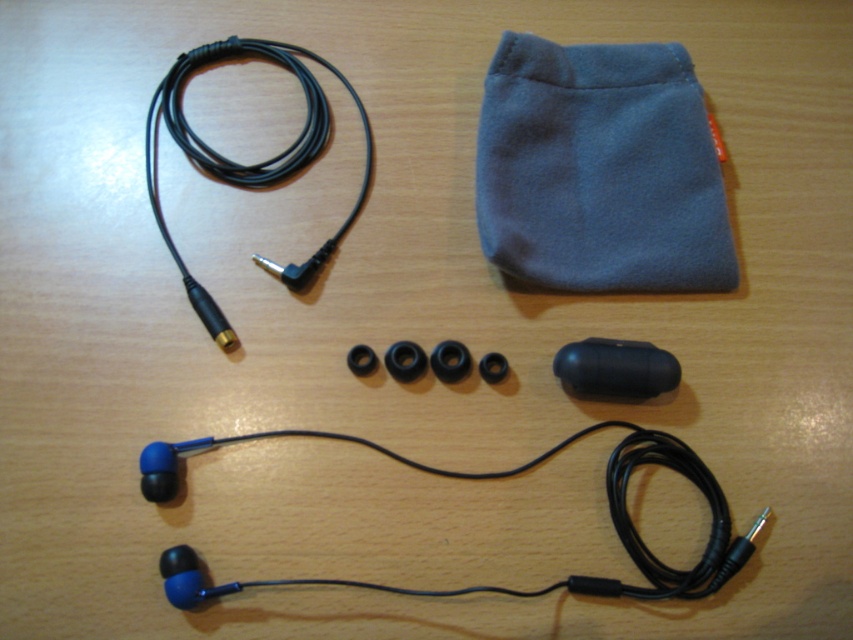
Question: Among these objects, which one is farthest from the camera?

Choices:
 (A) blue matte earphones at bottom
 (B) black cable at upper left
 (C) blue fleece pouch at upper right

Answer: (C)

Question: Can you confirm if blue fleece pouch at upper right is positioned to the left of blue matte earphones at bottom?

Choices:
 (A) yes
 (B) no

Answer: (B)

Question: Which object appears farthest from the camera in this image?

Choices:
 (A) blue fleece pouch at upper right
 (B) black cable at upper left
 (C) blue matte earphones at bottom

Answer: (A)

Question: Which object is positioned farthest from the black cable at upper left?

Choices:
 (A) blue fleece pouch at upper right
 (B) blue matte earphones at bottom

Answer: (B)

Question: Can you confirm if blue fleece pouch at upper right is smaller than blue matte earphones at bottom?

Choices:
 (A) yes
 (B) no

Answer: (A)

Question: Can you confirm if blue fleece pouch at upper right is bigger than black cable at upper left?

Choices:
 (A) yes
 (B) no

Answer: (B)